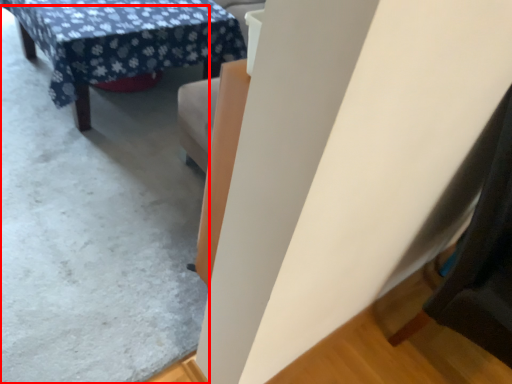
Question: From the image's perspective, what is the correct spatial relationship of concrete (annotated by the red box) in relation to table?

Choices:
 (A) below
 (B) above

Answer: (A)